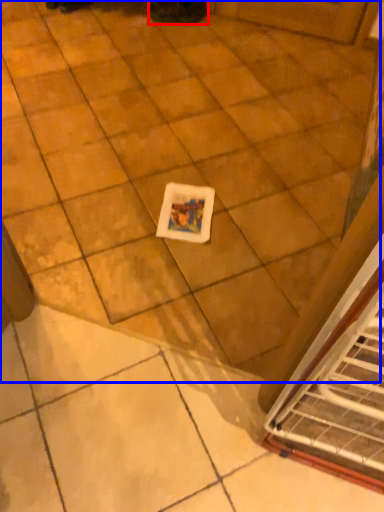
Question: Which object is further to the camera taking this photo, footwear (highlighted by a red box) or ceramic tile (highlighted by a blue box)?

Choices:
 (A) footwear
 (B) ceramic tile

Answer: (A)